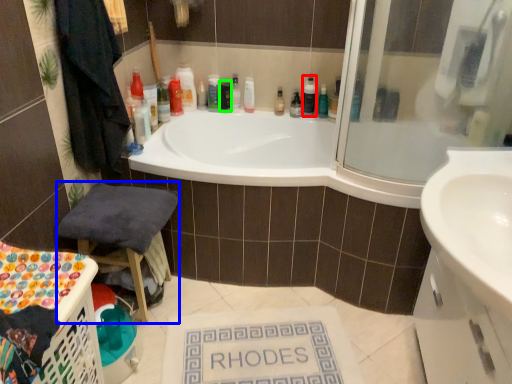
Question: Considering the real-world distances, which object is farthest from cleaning product (highlighted by a red box)? chair (highlighted by a blue box) or toiletry (highlighted by a green box)?

Choices:
 (A) chair
 (B) toiletry

Answer: (A)